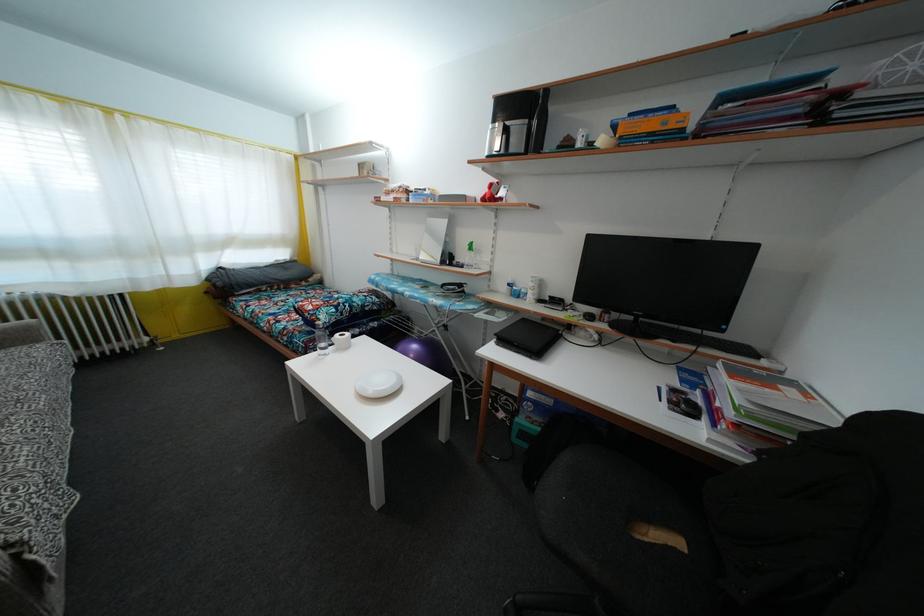
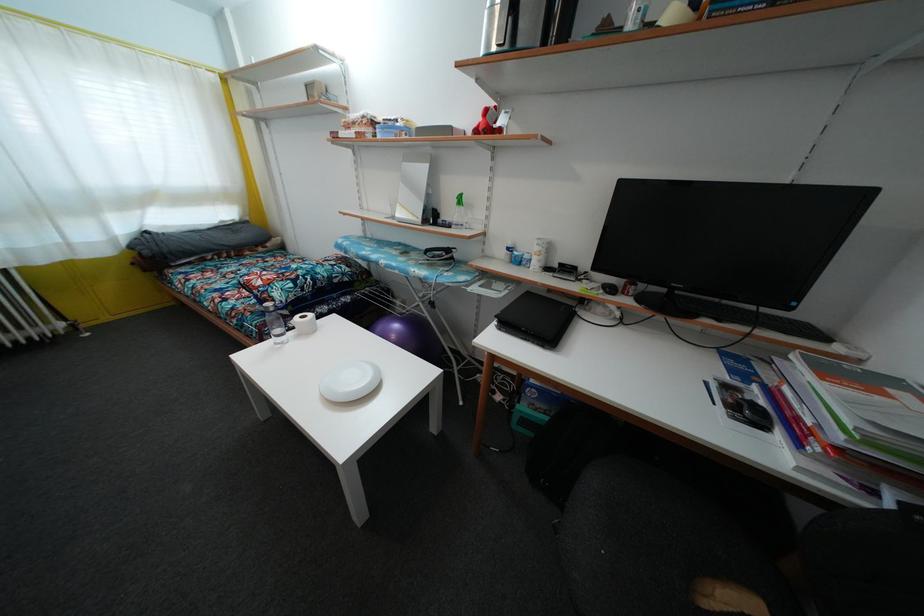
Locate, in the second image, the point that corresponds to the point at 386,390 in the first image.

(359, 387)